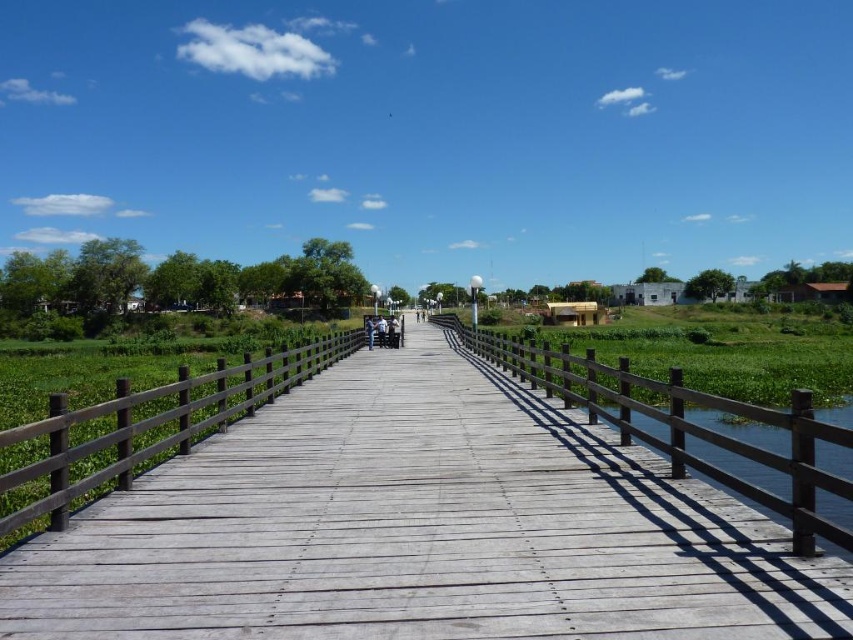
Is weathered wood bridge at center shorter than clear water at right?

Yes, weathered wood bridge at center is shorter than clear water at right.

Between weathered wood bridge at center and clear water at right, which one has more height?

With more height is clear water at right.

Which is in front, point (334, 576) or point (785, 484)?

Positioned in front is point (334, 576).

Where is `weathered wood bridge at center`? The width and height of the screenshot is (853, 640). weathered wood bridge at center is located at coordinates (418, 529).